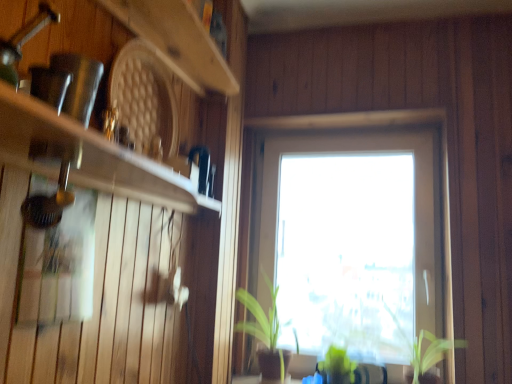
Question: From the image's perspective, is wooden at upper left, which appears as the second shelf when ordered from the bottom, above green matte plant at center, placed as the first plant when sorted from left to right?

Choices:
 (A) no
 (B) yes

Answer: (B)

Question: Is wooden at upper left, which appears as the first shelf when viewed from the top, surrounding green matte plant at center, placed as the first plant when sorted from left to right?

Choices:
 (A) no
 (B) yes

Answer: (A)

Question: Can you confirm if wooden at upper left, which appears as the second shelf when ordered from the bottom, is positioned to the left of green matte plant at center, placed as the first plant when sorted from left to right?

Choices:
 (A) yes
 (B) no

Answer: (A)

Question: Can you confirm if wooden at upper left, which appears as the second shelf when ordered from the bottom, is smaller than green matte plant at center, which ranks as the third plant in right-to-left order?

Choices:
 (A) yes
 (B) no

Answer: (A)

Question: Does wooden at upper left, which appears as the second shelf when ordered from the bottom, have a larger size compared to green matte plant at center, which ranks as the third plant in right-to-left order?

Choices:
 (A) no
 (B) yes

Answer: (A)

Question: In terms of width, does matte white shelf at left, the first shelf in the bottom-to-top sequence, look wider or thinner when compared to green matte plant at center, placed as the first plant when sorted from left to right?

Choices:
 (A) wide
 (B) thin

Answer: (B)

Question: Is matte white shelf at left, the first shelf in the bottom-to-top sequence, in front of or behind green matte plant at center, which ranks as the third plant in right-to-left order, in the image?

Choices:
 (A) behind
 (B) front

Answer: (B)

Question: From the image's perspective, is matte white shelf at left, the first shelf in the bottom-to-top sequence, positioned above or below green matte plant at center, placed as the first plant when sorted from left to right?

Choices:
 (A) above
 (B) below

Answer: (A)

Question: Looking at the image, does matte white shelf at left, the 2th shelf positioned from the top, seem bigger or smaller compared to green matte plant at center, which ranks as the third plant in right-to-left order?

Choices:
 (A) big
 (B) small

Answer: (B)

Question: Considering the positions of matte white shelf at left, the 2th shelf positioned from the top, and transparent glass window at center in the image, is matte white shelf at left, the 2th shelf positioned from the top, bigger or smaller than transparent glass window at center?

Choices:
 (A) big
 (B) small

Answer: (B)

Question: Does point (23, 158) appear closer or farther from the camera than point (445, 289)?

Choices:
 (A) closer
 (B) farther

Answer: (A)

Question: Which is correct: matte white shelf at left, the 2th shelf positioned from the top, is inside transparent glass window at center, or outside of it?

Choices:
 (A) inside
 (B) outside

Answer: (B)

Question: From their relative heights in the image, would you say matte white shelf at left, the first shelf in the bottom-to-top sequence, is taller or shorter than transparent glass window at center?

Choices:
 (A) tall
 (B) short

Answer: (B)

Question: Looking at their shapes, would you say green leafy plant at lower center, the 2th plant from the right, is wider or thinner than green matte plant at center, placed as the first plant when sorted from left to right?

Choices:
 (A) wide
 (B) thin

Answer: (B)

Question: Considering their positions, is green leafy plant at lower center, the second plant in the left-to-right sequence, located in front of or behind green matte plant at center, placed as the first plant when sorted from left to right?

Choices:
 (A) behind
 (B) front

Answer: (A)